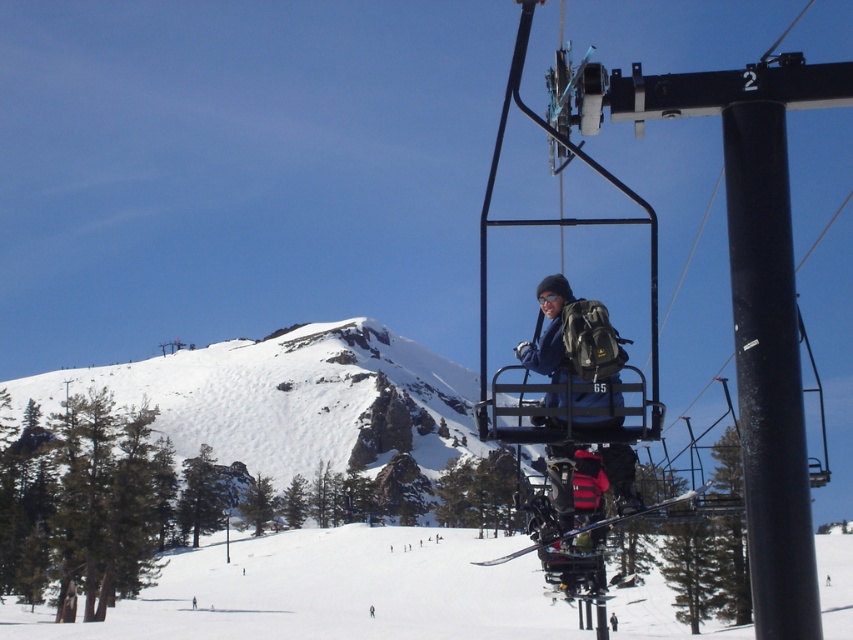
Question: Considering the relative positions of white snow ski slope at center and black matte pole at center right in the image provided, where is white snow ski slope at center located with respect to black matte pole at center right?

Choices:
 (A) below
 (B) above

Answer: (A)

Question: Which object is closer to the camera taking this photo?

Choices:
 (A) matte blue jacket at center
 (B) black matte pole at center right
 (C) metallic blue ski lift at upper right
 (D) white snow ski slope at center

Answer: (C)

Question: Can you confirm if metallic blue ski lift at upper right is positioned to the right of black matte pole at center right?

Choices:
 (A) yes
 (B) no

Answer: (A)

Question: Which point is closer to the camera?

Choices:
 (A) matte blue jacket at center
 (B) black matte pole at center right
 (C) white snow ski slope at center

Answer: (B)

Question: Which object is farther from the camera taking this photo?

Choices:
 (A) black matte pole at center right
 (B) white snow ski slope at center

Answer: (B)

Question: Does white snow ski slope at center have a smaller size compared to matte blue jacket at center?

Choices:
 (A) yes
 (B) no

Answer: (B)